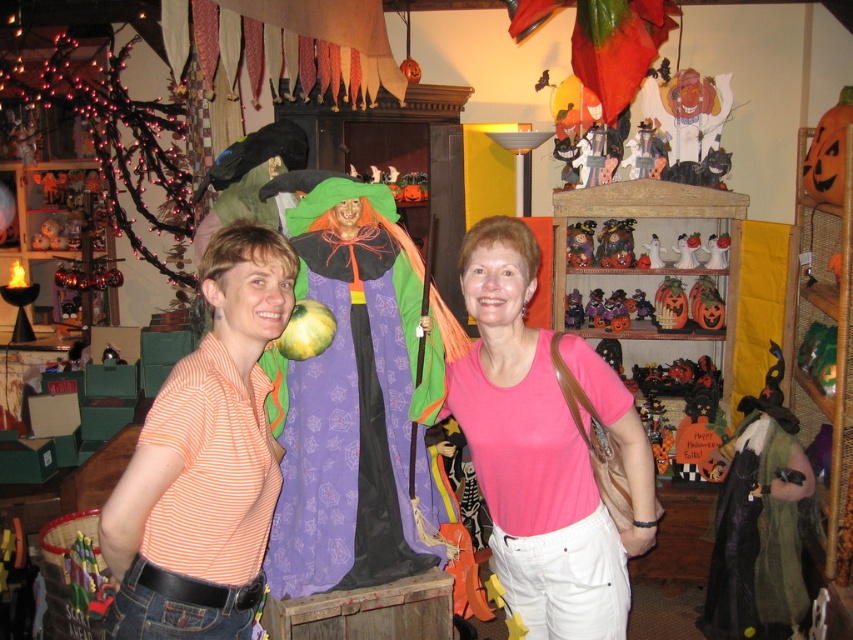
Question: Which point appears farthest from the camera in this image?

Choices:
 (A) (364, 524)
 (B) (225, 445)

Answer: (A)

Question: Considering the relative positions of pink cotton shirt at center and orange striped shirt at center in the image provided, where is pink cotton shirt at center located with respect to orange striped shirt at center?

Choices:
 (A) below
 (B) above

Answer: (A)

Question: Does pink cotton shirt at center have a lesser width compared to orange striped shirt at center?

Choices:
 (A) yes
 (B) no

Answer: (B)

Question: Among these objects, which one is nearest to the camera?

Choices:
 (A) purple fabric witch at center
 (B) orange striped shirt at center
 (C) matte plastic pumpkin at center
 (D) pink cotton shirt at center

Answer: (B)

Question: Which object is the closest to the orange striped shirt at center?

Choices:
 (A) purple fabric witch at center
 (B) matte plastic pumpkin at center

Answer: (A)

Question: Is purple fabric witch at center thinner than pink cotton shirt at center?

Choices:
 (A) no
 (B) yes

Answer: (B)